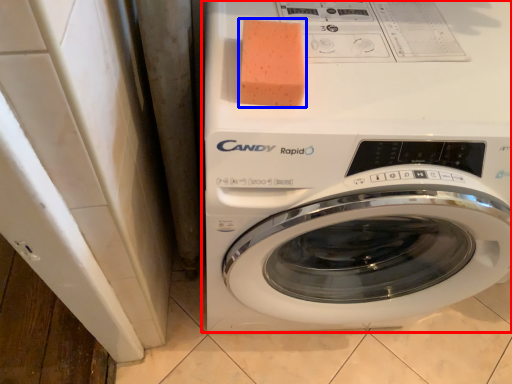
Question: Which point is further to the camera, washing machine (highlighted by a red box) or soap (highlighted by a blue box)?

Choices:
 (A) washing machine
 (B) soap

Answer: (B)